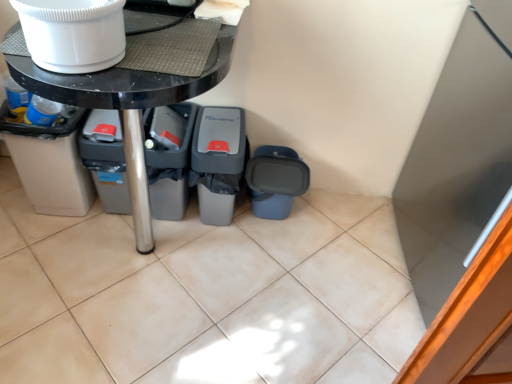
Question: Considering the relative sizes of gray plastic recycling bin at center, marked as the 3th recycling bin in a left-to-right arrangement, and white glossy refrigerator at upper right in the image provided, is gray plastic recycling bin at center, marked as the 3th recycling bin in a left-to-right arrangement, smaller than white glossy refrigerator at upper right?

Choices:
 (A) no
 (B) yes

Answer: (B)

Question: Would you consider gray plastic recycling bin at center, which is the second recycling bin from right to left, to be distant from white glossy refrigerator at upper right?

Choices:
 (A) yes
 (B) no

Answer: (B)

Question: Are gray plastic recycling bin at center, marked as the 3th recycling bin in a left-to-right arrangement, and white glossy refrigerator at upper right making contact?

Choices:
 (A) yes
 (B) no

Answer: (B)

Question: From the image's perspective, is gray plastic recycling bin at center, marked as the 3th recycling bin in a left-to-right arrangement, located beneath white glossy refrigerator at upper right?

Choices:
 (A) no
 (B) yes

Answer: (A)

Question: Is gray plastic recycling bin at center, marked as the 3th recycling bin in a left-to-right arrangement, to the right of white glossy refrigerator at upper right from the viewer's perspective?

Choices:
 (A) yes
 (B) no

Answer: (B)

Question: Considering the positions of gray plastic recycling bin at center, which is counted as the third recycling bin, starting from the right, and gray plastic recycling bin at center, marked as the 3th recycling bin in a left-to-right arrangement, in the image, is gray plastic recycling bin at center, which is counted as the third recycling bin, starting from the right, taller or shorter than gray plastic recycling bin at center, marked as the 3th recycling bin in a left-to-right arrangement,?

Choices:
 (A) short
 (B) tall

Answer: (A)

Question: In terms of width, does gray plastic recycling bin at center, which is counted as the third recycling bin, starting from the right, look wider or thinner when compared to gray plastic recycling bin at center, which is the second recycling bin from right to left?

Choices:
 (A) wide
 (B) thin

Answer: (B)

Question: From a real-world perspective, is gray plastic recycling bin at center, which is counted as the third recycling bin, starting from the right, positioned above or below gray plastic recycling bin at center, which is the second recycling bin from right to left?

Choices:
 (A) above
 (B) below

Answer: (A)

Question: Does point (183, 140) appear closer or farther from the camera than point (201, 160)?

Choices:
 (A) farther
 (B) closer

Answer: (A)

Question: In terms of width, does gray plastic recycling bin at center, marked as the 3th recycling bin in a left-to-right arrangement, look wider or thinner when compared to blue matte recycling bin at lower right, which appears as the 1th recycling bin when viewed from the right?

Choices:
 (A) thin
 (B) wide

Answer: (B)

Question: Considering the positions of gray plastic recycling bin at center, which is the second recycling bin from right to left, and blue matte recycling bin at lower right, which appears as the 1th recycling bin when viewed from the right, in the image, is gray plastic recycling bin at center, which is the second recycling bin from right to left, taller or shorter than blue matte recycling bin at lower right, which appears as the 1th recycling bin when viewed from the right,?

Choices:
 (A) tall
 (B) short

Answer: (A)

Question: Looking at the image, does gray plastic recycling bin at center, marked as the 3th recycling bin in a left-to-right arrangement, seem bigger or smaller compared to blue matte recycling bin at lower right, which is the 4th recycling bin in left-to-right order?

Choices:
 (A) big
 (B) small

Answer: (A)

Question: From the image's perspective, relative to blue matte recycling bin at lower right, which appears as the 1th recycling bin when viewed from the right, is gray plastic recycling bin at center, marked as the 3th recycling bin in a left-to-right arrangement, above or below?

Choices:
 (A) below
 (B) above

Answer: (B)

Question: In terms of height, does gray plastic bin at lower left look taller or shorter compared to white glossy toilet bowl at upper left?

Choices:
 (A) tall
 (B) short

Answer: (A)

Question: From a real-world perspective, is gray plastic bin at lower left physically located above or below white glossy toilet bowl at upper left?

Choices:
 (A) above
 (B) below

Answer: (B)